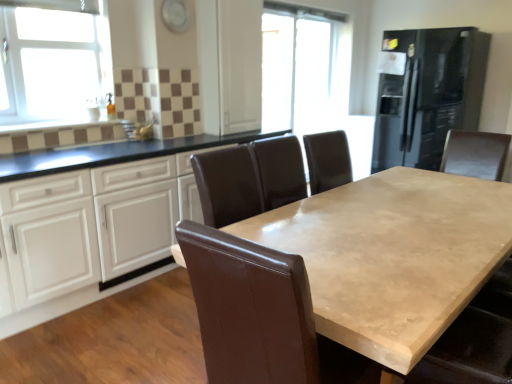
Question: Is white glass window at upper left facing towards black glass refrigerator at right?

Choices:
 (A) no
 (B) yes

Answer: (A)

Question: Is white glass window at upper left behind black glass refrigerator at right?

Choices:
 (A) no
 (B) yes

Answer: (A)

Question: Can you confirm if white glass window at upper left is smaller than black glass refrigerator at right?

Choices:
 (A) yes
 (B) no

Answer: (A)

Question: Does white glass window at upper left contain black glass refrigerator at right?

Choices:
 (A) yes
 (B) no

Answer: (B)

Question: Is there a large distance between white glass window at upper left and black glass refrigerator at right?

Choices:
 (A) yes
 (B) no

Answer: (A)

Question: Considering the positions of transparent glass door at center and white glossy cabinets at center in the image, is transparent glass door at center bigger or smaller than white glossy cabinets at center?

Choices:
 (A) big
 (B) small

Answer: (B)

Question: In terms of width, does transparent glass door at center look wider or thinner when compared to white glossy cabinets at center?

Choices:
 (A) thin
 (B) wide

Answer: (A)

Question: Is transparent glass door at center inside the boundaries of white glossy cabinets at center, or outside?

Choices:
 (A) outside
 (B) inside

Answer: (A)

Question: In terms of height, does transparent glass door at center look taller or shorter compared to white glossy cabinets at center?

Choices:
 (A) tall
 (B) short

Answer: (A)

Question: From a real-world perspective, is black glass refrigerator at right above or below beige polished wood table at center?

Choices:
 (A) above
 (B) below

Answer: (A)

Question: Does point (413, 94) appear closer or farther from the camera than point (392, 286)?

Choices:
 (A) farther
 (B) closer

Answer: (A)

Question: Is black glass refrigerator at right spatially inside beige polished wood table at center, or outside of it?

Choices:
 (A) inside
 (B) outside

Answer: (B)

Question: From the image's perspective, relative to beige polished wood table at center, is black glass refrigerator at right above or below?

Choices:
 (A) above
 (B) below

Answer: (A)

Question: Considering the positions of transparent glass door at center and brown leather swivel chair at center in the image, is transparent glass door at center wider or thinner than brown leather swivel chair at center?

Choices:
 (A) wide
 (B) thin

Answer: (B)

Question: Based on their sizes in the image, would you say transparent glass door at center is bigger or smaller than brown leather swivel chair at center?

Choices:
 (A) big
 (B) small

Answer: (A)